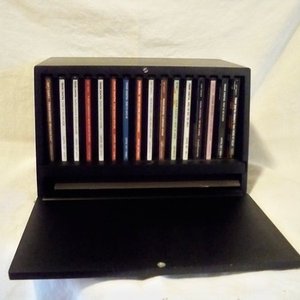
This screenshot has width=300, height=300. What are the coordinates of `cd holder` in the screenshot? It's located at (150, 206).